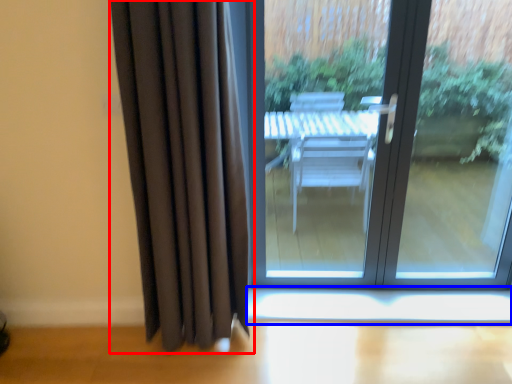
Question: Among these objects, which one is farthest to the camera, curtain (highlighted by a red box) or window sill (highlighted by a blue box)?

Choices:
 (A) curtain
 (B) window sill

Answer: (B)